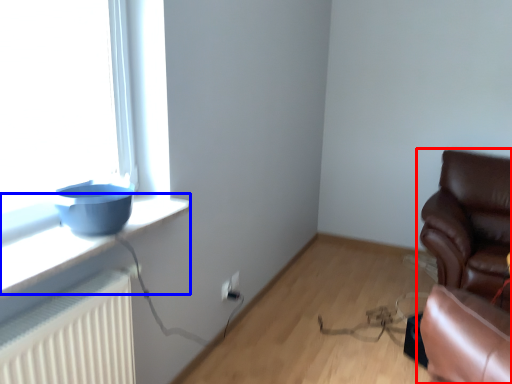
Question: Which of the following is the farthest to the observer, chair (highlighted by a red box) or window sill (highlighted by a blue box)?

Choices:
 (A) chair
 (B) window sill

Answer: (A)